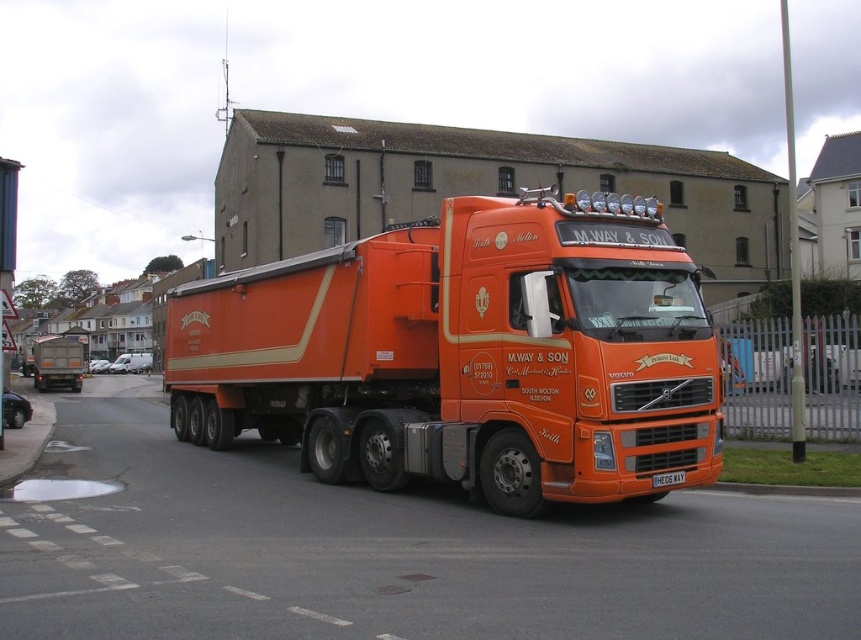
You are a photographer planning to take a picture of the orange matte trailer truck at center and the orange matte truck at center. Since you want to capture both in the frame, which one should you focus on first to ensure the other is also in view?

The orange matte trailer truck at center is above the orange matte truck at center, so focusing on the orange matte trailer truck at center first would ensure the orange matte truck at center is also in view below it.

What object is located at the coordinates point (466,355)?

The point (466,355) indicates the orange matte trailer truck at center.

You are a photographer trying to capture both the orange matte truck at center and the white plastic license plate at center in a single frame. Given their sizes, which object will appear larger in your photo?

The orange matte truck at center is bigger than the white plastic license plate at center, so it will appear larger in the photo.